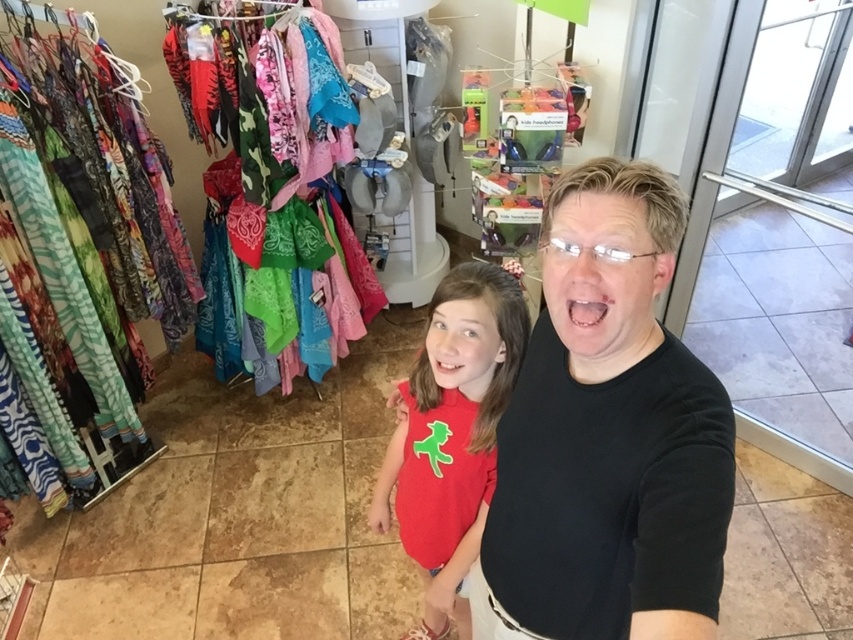
Question: In this image, where is black matte t-shirt at center located relative to matte red t-shirt at center?

Choices:
 (A) above
 (B) below

Answer: (A)

Question: Does black matte t-shirt at center have a larger size compared to matte red t-shirt at center?

Choices:
 (A) yes
 (B) no

Answer: (B)

Question: Which of the following is the closest to the observer?

Choices:
 (A) (664, 332)
 (B) (473, 461)

Answer: (A)

Question: Among these objects, which one is nearest to the camera?

Choices:
 (A) black matte t-shirt at center
 (B) matte red t-shirt at center

Answer: (A)

Question: Does black matte t-shirt at center appear on the left side of matte red t-shirt at center?

Choices:
 (A) no
 (B) yes

Answer: (A)